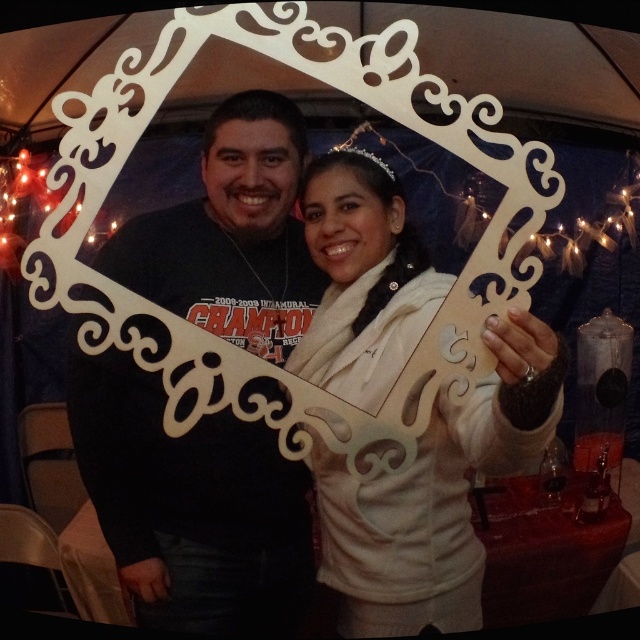
Question: From the image, what is the correct spatial relationship of black matte t-shirt at center in relation to white matte jacket at center?

Choices:
 (A) above
 (B) below

Answer: (A)

Question: Is black matte t-shirt at center to the left of white matte jacket at center from the viewer's perspective?

Choices:
 (A) no
 (B) yes

Answer: (B)

Question: Observing the image, what is the correct spatial positioning of black matte t-shirt at center in reference to white matte jacket at center?

Choices:
 (A) below
 (B) above

Answer: (B)